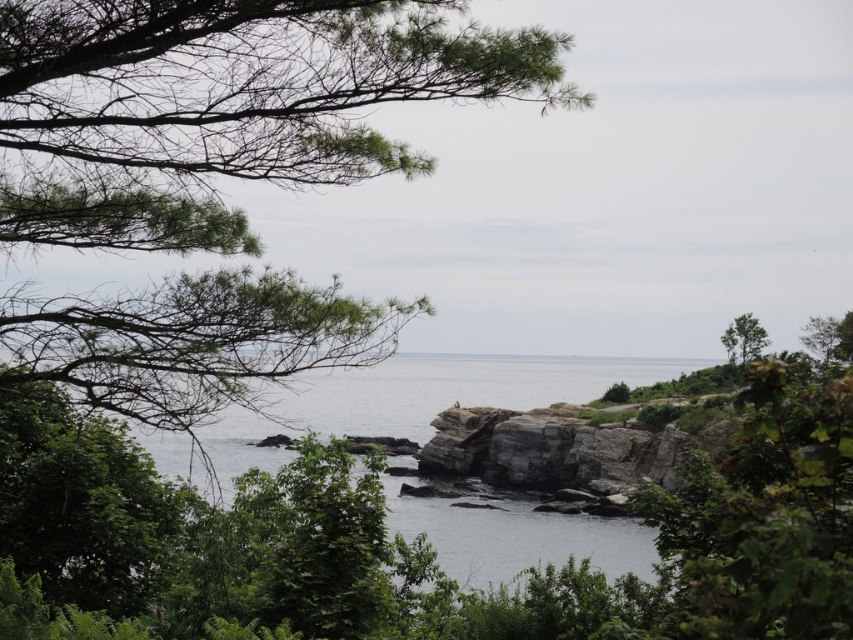
Question: Is green needle-like leaves at upper left thinner than green leafy tree at upper right?

Choices:
 (A) no
 (B) yes

Answer: (B)

Question: Considering the relative positions of clear water at center and green leafy tree at upper right in the image provided, where is clear water at center located with respect to green leafy tree at upper right?

Choices:
 (A) right
 (B) left

Answer: (B)

Question: Which point is closer to the camera taking this photo?

Choices:
 (A) (744, 358)
 (B) (399, 33)

Answer: (B)

Question: Which of the following is the closest to the observer?

Choices:
 (A) green leafy tree at upper right
 (B) green needle-like leaves at upper left

Answer: (B)

Question: Does clear water at center appear over green leafy tree at upper right?

Choices:
 (A) no
 (B) yes

Answer: (A)

Question: Estimate the real-world distances between objects in this image. Which object is closer to the clear water at center?

Choices:
 (A) green needle-like leaves at upper left
 (B) green leafy tree at upper right

Answer: (B)